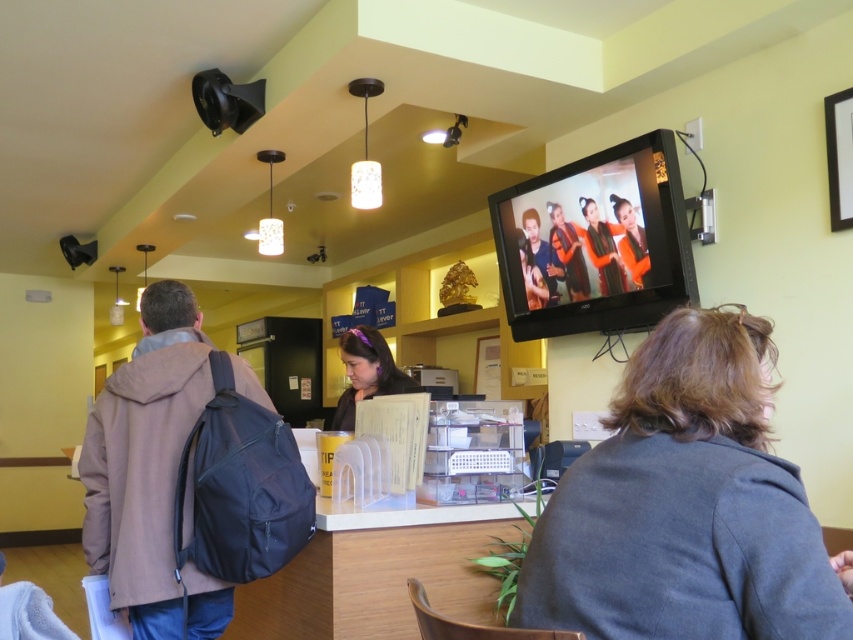
Question: Which of the following is the farthest from the observer?

Choices:
 (A) (155, 384)
 (B) (747, 392)

Answer: (A)

Question: Is dark gray fabric jacket at lower right positioned before orange fabric woman at upper center?

Choices:
 (A) no
 (B) yes

Answer: (B)

Question: Can you confirm if dark gray fabric jacket at lower right is smaller than orange fabric woman at upper center?

Choices:
 (A) no
 (B) yes

Answer: (A)

Question: Which point is farther to the camera?

Choices:
 (A) (515, 621)
 (B) (608, 278)
 (C) (352, 346)

Answer: (C)

Question: Which object is closer to the camera taking this photo?

Choices:
 (A) orange fabric woman at upper center
 (B) brown fabric backpack at left
 (C) matte orange dress at upper center

Answer: (B)

Question: Considering the relative positions of matte purple hairband at center and matte orange dress at upper center in the image provided, where is matte purple hairband at center located with respect to matte orange dress at upper center?

Choices:
 (A) right
 (B) left

Answer: (B)